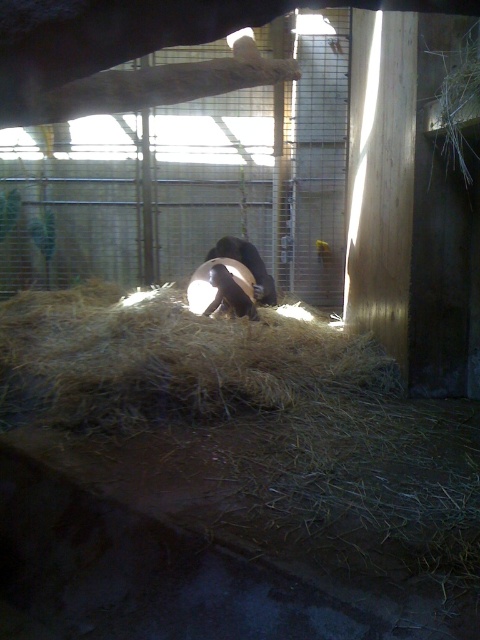
Describe the element at coordinates (165, 358) in the screenshot. I see `brown dry hay at center` at that location.

Which is in front, point (96, 346) or point (196, 307)?

Positioned in front is point (96, 346).

At what (x,y) coordinates should I click in order to perform the action: click on brown dry hay at center. Please return your answer as a coordinate pair (x, y). Looking at the image, I should click on (165, 358).

Who is lower down, brown fur monkey at center or brown fuzzy bear at center?

brown fur monkey at center

Who is higher up, brown fur monkey at center or brown fuzzy bear at center?

brown fuzzy bear at center is higher up.

This screenshot has height=640, width=480. I want to click on brown fur monkey at center, so click(222, 289).

Between brown dry hay at center and brown fuzzy bear at center, which one is positioned higher?

brown fuzzy bear at center

Does brown dry hay at center appear under brown fuzzy bear at center?

Yes, brown dry hay at center is below brown fuzzy bear at center.

What do you see at coordinates (165, 358) in the screenshot?
I see `brown dry hay at center` at bounding box center [165, 358].

Image resolution: width=480 pixels, height=640 pixels. In order to click on brown dry hay at center in this screenshot , I will do `click(165, 358)`.